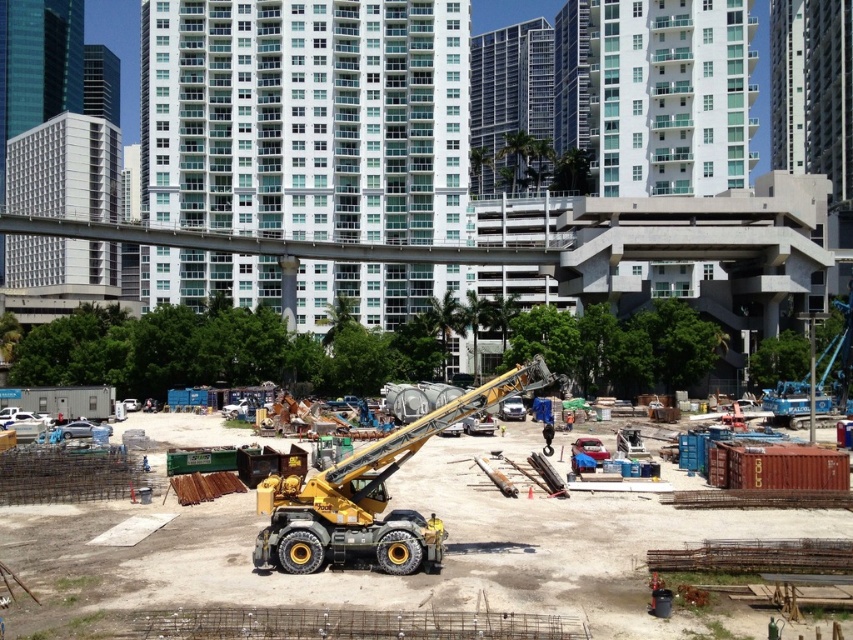
You are a construction worker standing at the edge of the construction site. You need to move a heavy beam from the yellow metallic crane at center to the yellow metallic excavator at center. Which direction should you move the beam so it doesn not hit any obstacles?

The yellow metallic crane at center is in front of the yellow metallic excavator at center, so you should move the beam backward to avoid hitting the excavator.

Looking at this image, you are a construction worker standing at the edge of the construction site. You need to move materials from point A to point B. Point A is located at point [172,573] and point B is at point [291,550]. Which point is closer to you, the worker?

Point A at point [172,573] is closer to you because it is further to the viewer than point B at point [291,550].